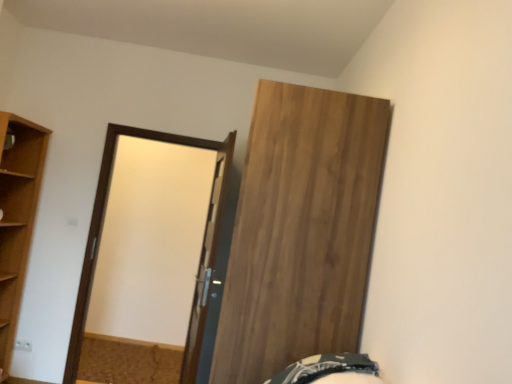
Question: From a real-world perspective, is light brown wood at left under white glossy door at center, which is the second door in right-to-left order?

Choices:
 (A) yes
 (B) no

Answer: (A)

Question: Is light brown wood at left positioned beyond the bounds of white glossy door at center, which ranks as the 1th door in left-to-right order?

Choices:
 (A) yes
 (B) no

Answer: (A)

Question: Is light brown wood at left oriented away from white glossy door at center, which ranks as the 1th door in left-to-right order?

Choices:
 (A) yes
 (B) no

Answer: (B)

Question: Would you consider light brown wood at left to be distant from white glossy door at center, which ranks as the 1th door in left-to-right order?

Choices:
 (A) no
 (B) yes

Answer: (B)

Question: Is the position of light brown wood at left less distant than that of white glossy door at center, which ranks as the 1th door in left-to-right order?

Choices:
 (A) yes
 (B) no

Answer: (B)

Question: Is light brown wood at left taller than white glossy door at center, which ranks as the 1th door in left-to-right order?

Choices:
 (A) no
 (B) yes

Answer: (B)

Question: From the image's perspective, is wooden door at upper right, the 1th door when ordered from right to left, located above white glossy door at center, which ranks as the 1th door in left-to-right order?

Choices:
 (A) yes
 (B) no

Answer: (A)

Question: Is wooden door at upper right, the 1th door when ordered from right to left, looking in the opposite direction of white glossy door at center, which ranks as the 1th door in left-to-right order?

Choices:
 (A) yes
 (B) no

Answer: (B)

Question: Considering the relative sizes of wooden door at upper right, the 1th door when ordered from right to left, and white glossy door at center, which is the second door in right-to-left order, in the image provided, is wooden door at upper right, the 1th door when ordered from right to left, taller than white glossy door at center, which is the second door in right-to-left order,?

Choices:
 (A) no
 (B) yes

Answer: (B)

Question: Is wooden door at upper right, the 1th door when ordered from right to left, closer to camera compared to white glossy door at center, which ranks as the 1th door in left-to-right order?

Choices:
 (A) yes
 (B) no

Answer: (A)

Question: Considering the relative sizes of wooden door at upper right, marked as the second door in a left-to-right arrangement, and white glossy door at center, which is the second door in right-to-left order, in the image provided, is wooden door at upper right, marked as the second door in a left-to-right arrangement, shorter than white glossy door at center, which is the second door in right-to-left order,?

Choices:
 (A) no
 (B) yes

Answer: (A)

Question: Can you confirm if wooden door at upper right, marked as the second door in a left-to-right arrangement, is positioned to the right of white glossy door at center, which is the second door in right-to-left order?

Choices:
 (A) yes
 (B) no

Answer: (A)

Question: Considering the relative sizes of dark green fabric bed at lower right and light brown wood at left in the image provided, is dark green fabric bed at lower right taller than light brown wood at left?

Choices:
 (A) yes
 (B) no

Answer: (B)